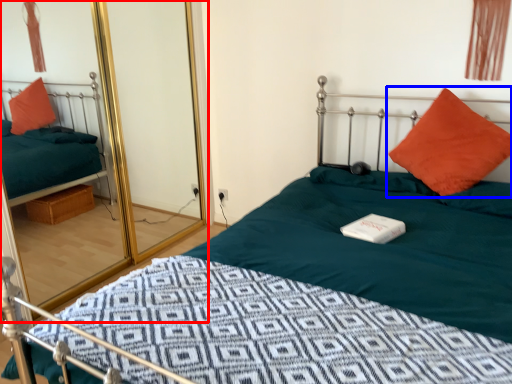
Question: Which object is further to the camera taking this photo, glass door (highlighted by a red box) or pillow (highlighted by a blue box)?

Choices:
 (A) glass door
 (B) pillow

Answer: (B)